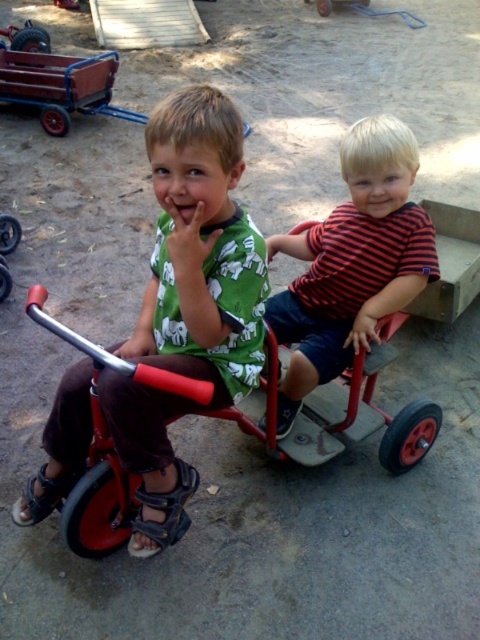
This screenshot has height=640, width=480. Describe the element at coordinates (352, 260) in the screenshot. I see `striped cotton shirt at center` at that location.

Identify the location of striped cotton shirt at center. The width and height of the screenshot is (480, 640). (352, 260).

Where is `green matte shirt at center`? green matte shirt at center is located at coordinates (201, 250).

Does point (63, 380) lie in front of point (48, 317)?

No, (63, 380) is behind (48, 317).

Does point (225, 241) come in front of point (96, 440)?

That is True.

I want to click on green matte shirt at center, so click(x=201, y=250).

Is green matte shirt at center wider than striped cotton shirt at center?

Indeed, green matte shirt at center has a greater width compared to striped cotton shirt at center.

Locate an element on the screen. This screenshot has width=480, height=640. green matte shirt at center is located at coordinates (201, 250).

I want to click on green matte shirt at center, so click(201, 250).